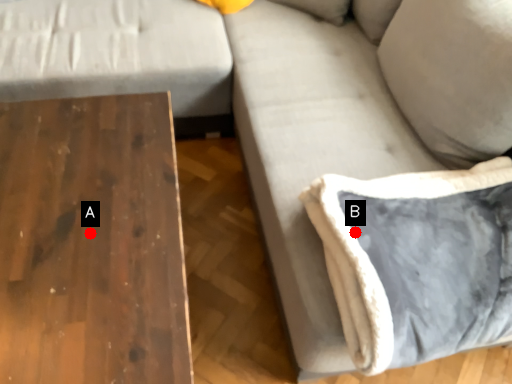
Question: Two points are circled on the image, labeled by A and B beside each circle. Which point appears farthest from the camera in this image?

Choices:
 (A) A is further
 (B) B is further

Answer: (B)